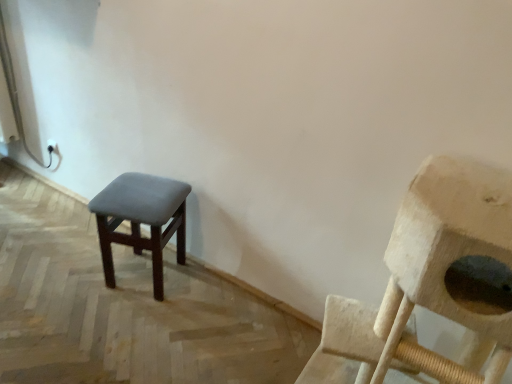
The image size is (512, 384). I want to click on free space to the right of dark gray fabric stool at left, so click(203, 296).